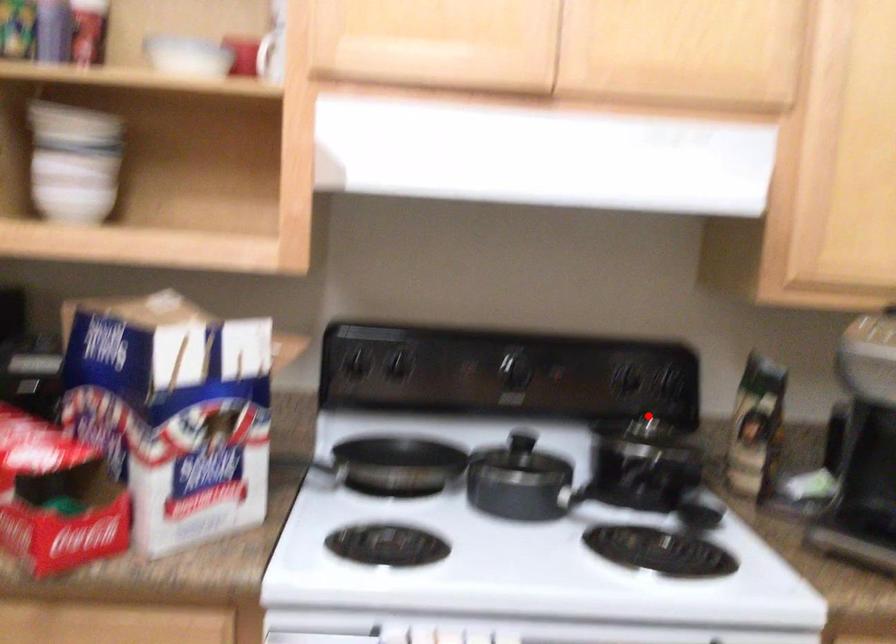
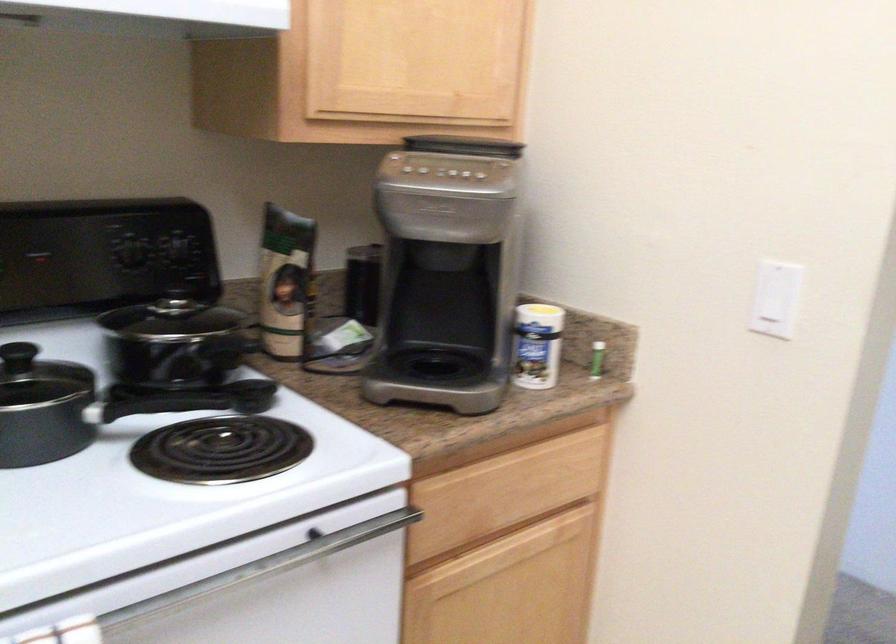
In the second image, find the point that corresponds to the highlighted location in the first image.

(177, 290)